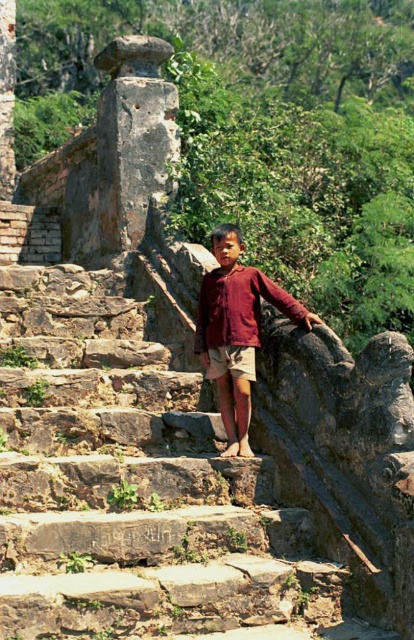
Question: Does brown stone stairs at center appear on the left side of khaki cotton shorts at center?

Choices:
 (A) no
 (B) yes

Answer: (B)

Question: Which point appears closest to the camera in this image?

Choices:
 (A) (247, 376)
 (B) (250, 356)

Answer: (A)

Question: Which point is closer to the camera?

Choices:
 (A) (211, 355)
 (B) (0, 342)

Answer: (A)

Question: Can you confirm if brown stone stairs at center is thinner than matte red shirt at center?

Choices:
 (A) yes
 (B) no

Answer: (B)

Question: Which object is closer to the camera taking this photo?

Choices:
 (A) khaki cotton shorts at center
 (B) matte red shirt at center

Answer: (B)

Question: Can you confirm if brown stone stairs at center is smaller than khaki cotton shorts at center?

Choices:
 (A) yes
 (B) no

Answer: (B)